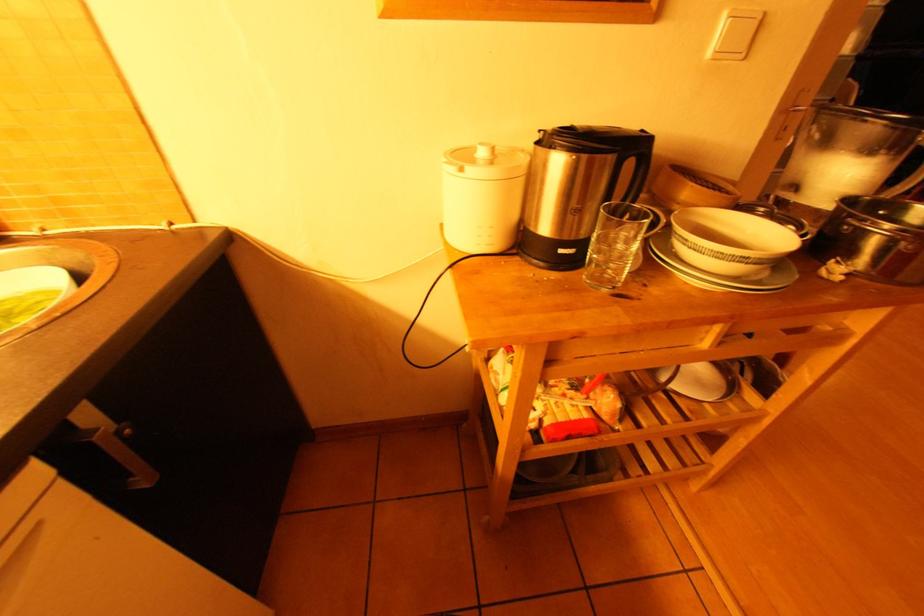
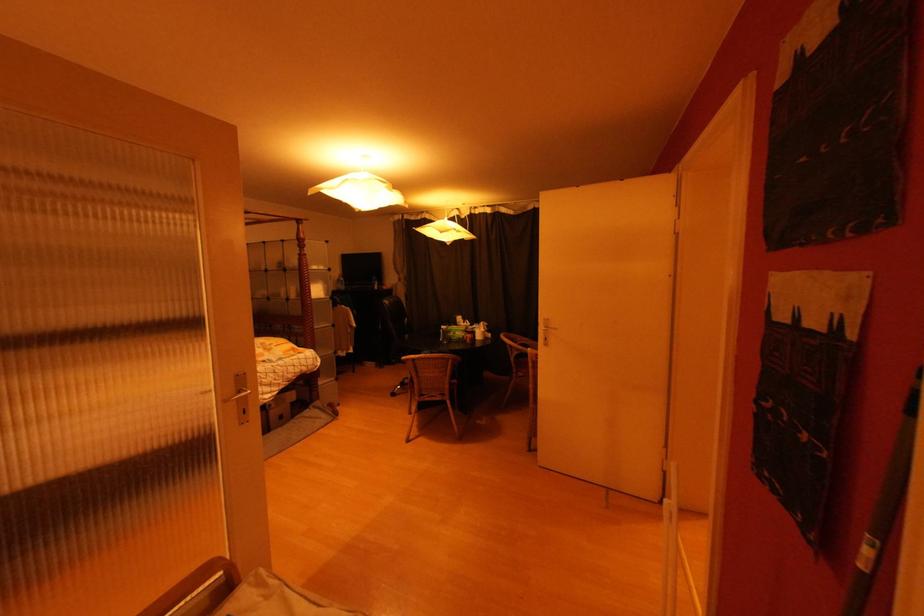
Question: The camera is either moving clockwise (left) or counter-clockwise (right) around the object. The first image is from the beginning of the video and the second image is from the end. Is the camera moving left or right when shooting the video?

Choices:
 (A) Left
 (B) Right

Answer: (A)